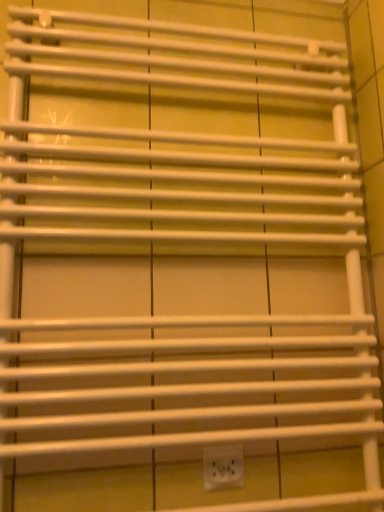
You are a GUI agent. You are given a task and a screenshot of the screen. Output one action in this format:
    pyautogui.click(x=<x>, y=<y>)
    Task: Click on the white plastic electric outlet at lower center
    This screenshot has height=512, width=384.
    Given the screenshot: What is the action you would take?
    pyautogui.click(x=223, y=466)

This screenshot has height=512, width=384. Describe the element at coordinates (223, 466) in the screenshot. I see `white plastic electric outlet at lower center` at that location.

Where is `white plastic electric outlet at lower center`? The image size is (384, 512). white plastic electric outlet at lower center is located at coordinates (223, 466).